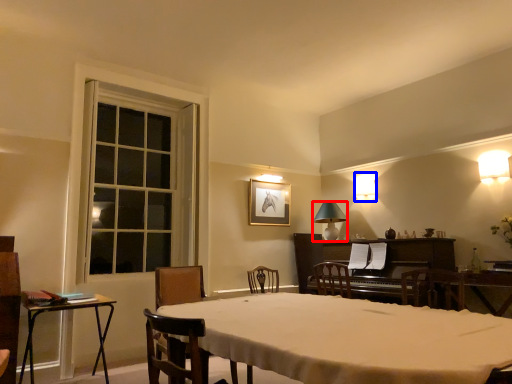
Question: Which of the following is the farthest to the observer, lamp (highlighted by a red box) or lamp (highlighted by a blue box)?

Choices:
 (A) lamp
 (B) lamp

Answer: (B)